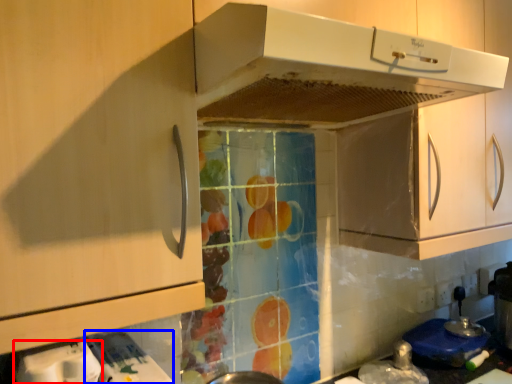
Question: Among these objects, which one is farthest to the camera, appliance (highlighted by a red box) or appliance (highlighted by a blue box)?

Choices:
 (A) appliance
 (B) appliance

Answer: (B)